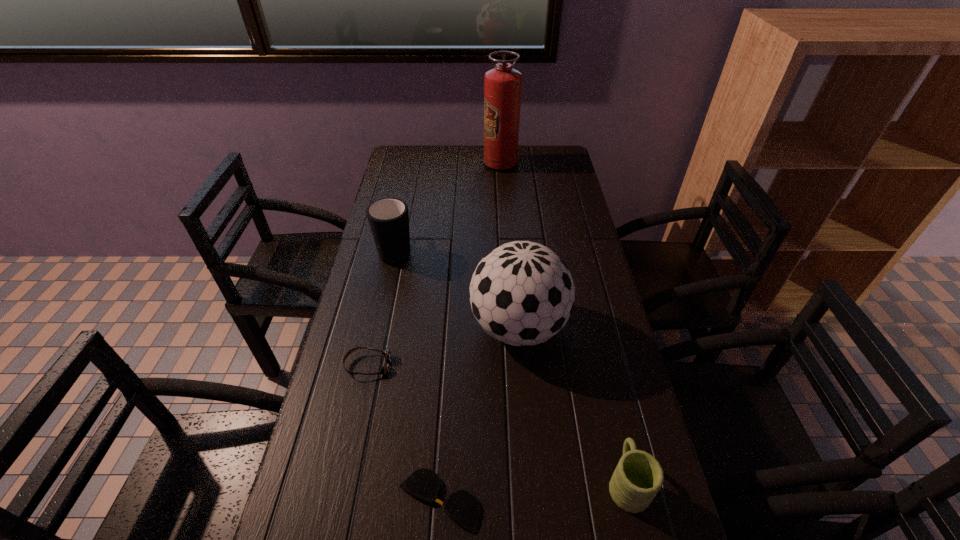
Find the location of `the tallest object`. the tallest object is located at coordinates (502, 85).

Find the location of a particular element. This screenshot has width=960, height=540. fire extinguisher is located at coordinates (502, 85).

The width and height of the screenshot is (960, 540). I want to click on soccer ball, so click(x=521, y=293).

Where is `the third tallest object`? This screenshot has width=960, height=540. the third tallest object is located at coordinates (388, 218).

Where is `the second farthest object`? The image size is (960, 540). the second farthest object is located at coordinates pos(388,218).

At what (x,y) coordinates should I click in order to perform the action: click on the third shortest object. Please return your answer as a coordinate pair (x, y). This screenshot has height=540, width=960. Looking at the image, I should click on (638, 477).

I want to click on the right mug, so click(638, 477).

Where is `goggles`? goggles is located at coordinates (387, 354).

Identify the location of spectacles. (463, 507).

Where is `free region located on the label side of the farthest object`? The height and width of the screenshot is (540, 960). free region located on the label side of the farthest object is located at coordinates coord(436,164).